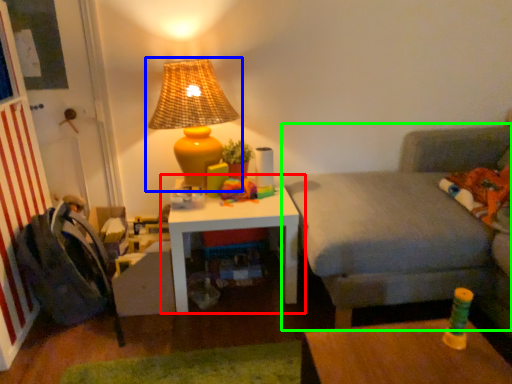
Question: Which object is the closest to the table (highlighted by a red box)? Choose among these: lamp (highlighted by a blue box) or studio couch (highlighted by a green box).

Choices:
 (A) lamp
 (B) studio couch

Answer: (A)